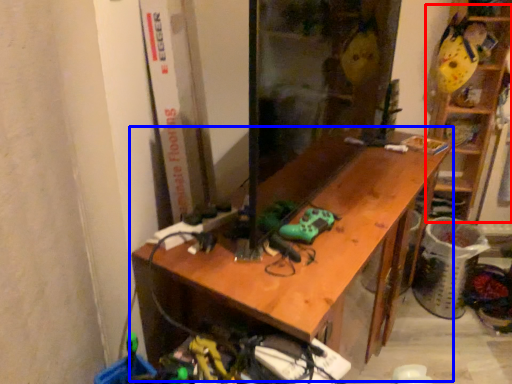
Question: Which point is closer to the camera, shelf (highlighted by a red box) or desk (highlighted by a blue box)?

Choices:
 (A) shelf
 (B) desk

Answer: (B)